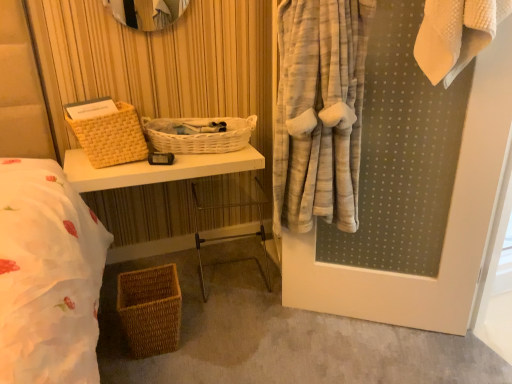
Question: Is clear plastic chair at center thinner than woven wicker basket at left, which ranks as the second basket in top-to-bottom order?

Choices:
 (A) no
 (B) yes

Answer: (A)

Question: Is clear plastic chair at center next to woven wicker basket at left, which ranks as the second basket in top-to-bottom order, and touching it?

Choices:
 (A) yes
 (B) no

Answer: (B)

Question: Is woven wicker basket at left, which is the second basket in bottom-to-top order, at the back of clear plastic chair at center?

Choices:
 (A) yes
 (B) no

Answer: (B)

Question: Is clear plastic chair at center not close to woven wicker basket at left, which ranks as the second basket in top-to-bottom order?

Choices:
 (A) no
 (B) yes

Answer: (A)

Question: Does clear plastic chair at center have a greater height compared to woven wicker basket at left, which ranks as the second basket in top-to-bottom order?

Choices:
 (A) yes
 (B) no

Answer: (A)

Question: From a real-world perspective, is clear plastic chair at center located higher than woven wicker basket at left, which ranks as the second basket in top-to-bottom order?

Choices:
 (A) no
 (B) yes

Answer: (A)

Question: Can you confirm if woven brown basket at lower left, marked as the first basket in a bottom-to-top arrangement, is shorter than woven wicker basket at left, which is the second basket in bottom-to-top order?

Choices:
 (A) no
 (B) yes

Answer: (B)

Question: Is woven wicker basket at left, which ranks as the second basket in top-to-bottom order, inside woven brown basket at lower left, marked as the first basket in a bottom-to-top arrangement?

Choices:
 (A) yes
 (B) no

Answer: (B)

Question: From a real-world perspective, is woven brown basket at lower left, marked as the first basket in a bottom-to-top arrangement, on top of woven wicker basket at left, which is the second basket in bottom-to-top order?

Choices:
 (A) yes
 (B) no

Answer: (B)

Question: Is woven brown basket at lower left, which is counted as the third basket, starting from the top, at the right side of woven wicker basket at left, which is the second basket in bottom-to-top order?

Choices:
 (A) yes
 (B) no

Answer: (A)

Question: From the image's perspective, is woven brown basket at lower left, marked as the first basket in a bottom-to-top arrangement, on woven wicker basket at left, which is the second basket in bottom-to-top order?

Choices:
 (A) yes
 (B) no

Answer: (B)

Question: From a real-world perspective, is woven brown basket at lower left, marked as the first basket in a bottom-to-top arrangement, positioned under woven wicker basket at left, which ranks as the second basket in top-to-bottom order, based on gravity?

Choices:
 (A) no
 (B) yes

Answer: (B)

Question: Can you confirm if white wicker basket at center, which ranks as the first basket in top-to-bottom order, is shorter than woven wicker basket at left, which is the second basket in bottom-to-top order?

Choices:
 (A) no
 (B) yes

Answer: (B)